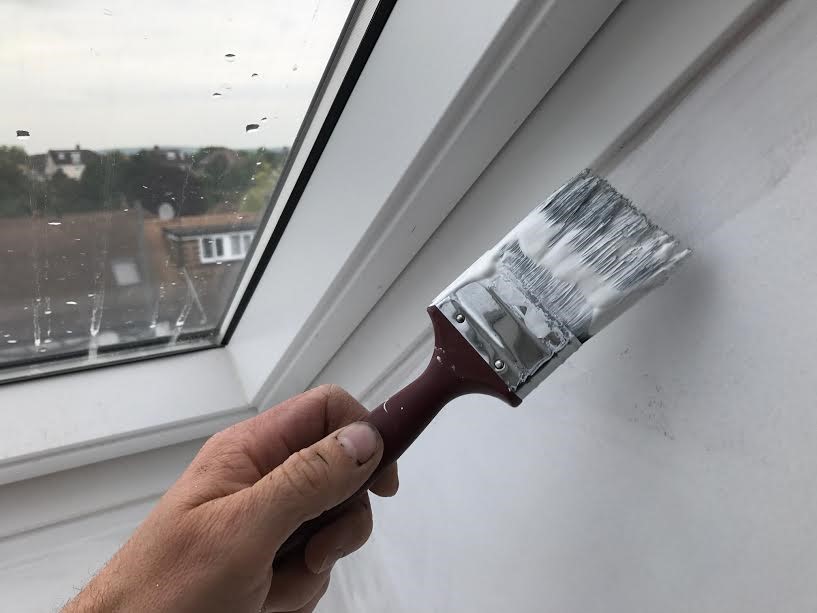
In order to click on window glazing in this screenshot , I will do `click(154, 164)`.